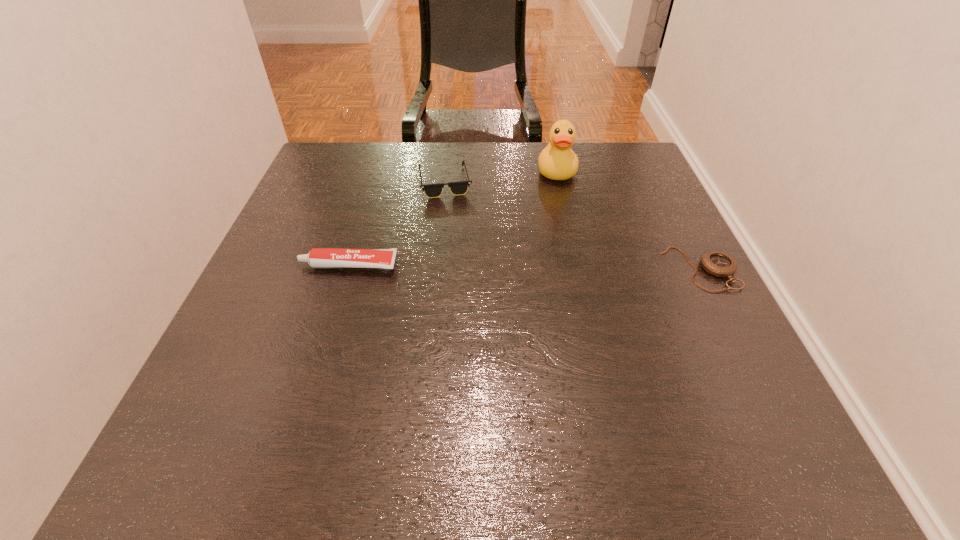
This screenshot has width=960, height=540. Find the location of `vacant area that lies between the third object from right to left and the rightmost object`. vacant area that lies between the third object from right to left and the rightmost object is located at coordinates (572, 225).

This screenshot has height=540, width=960. I want to click on free space between the second object from left to right and the leftmost object, so click(x=396, y=224).

Image resolution: width=960 pixels, height=540 pixels. Identify the location of empty space that is in between the second object from left to right and the second object from right to left. 500,177.

Identify the location of vacant space that's between the third object from right to left and the tallest object. (500, 177).

What are the coordinates of `unoccupied position between the leftmost object and the tallest object` in the screenshot? It's located at (452, 218).

Identify which object is the second nearest to the shortest object. Please provide its 2D coordinates. Your answer should be formatted as a tuple, i.e. [(x, y)], where the tuple contains the x and y coordinates of a point satisfying the conditions above.

[(457, 188)]

Identify which object is the nearest to the third object from left to right. Please provide its 2D coordinates. Your answer should be formatted as a tuple, i.e. [(x, y)], where the tuple contains the x and y coordinates of a point satisfying the conditions above.

[(457, 188)]

Where is `vacant point that satisfies the following two spatial constraints: 1. on the front side of the shortest object; 2. on the right side of the duck`? The width and height of the screenshot is (960, 540). vacant point that satisfies the following two spatial constraints: 1. on the front side of the shortest object; 2. on the right side of the duck is located at coordinates (579, 269).

The width and height of the screenshot is (960, 540). Identify the location of free location that satisfies the following two spatial constraints: 1. on the back side of the third object from right to left; 2. on the left side of the tallest object. (445, 171).